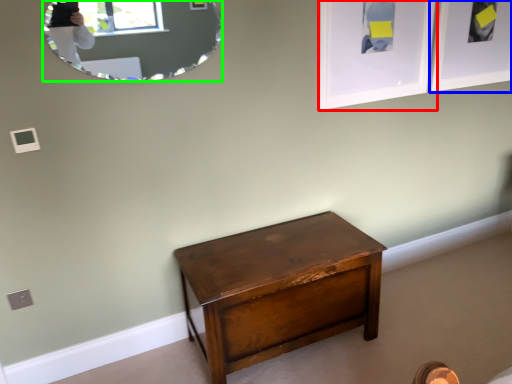
Question: Considering the real-world distances, which object is farthest from picture frame (highlighted by a red box)? picture frame (highlighted by a blue box) or mirror (highlighted by a green box)?

Choices:
 (A) picture frame
 (B) mirror

Answer: (B)